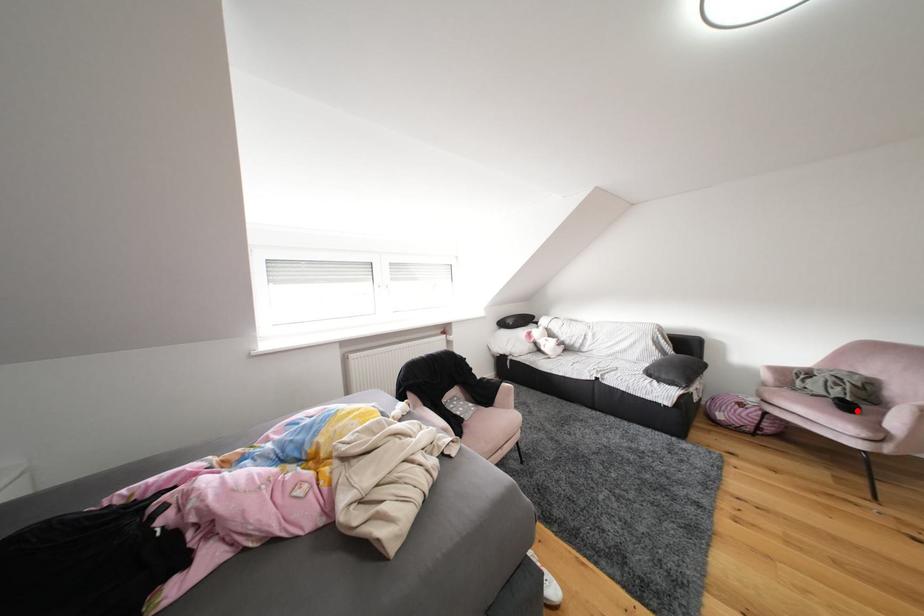
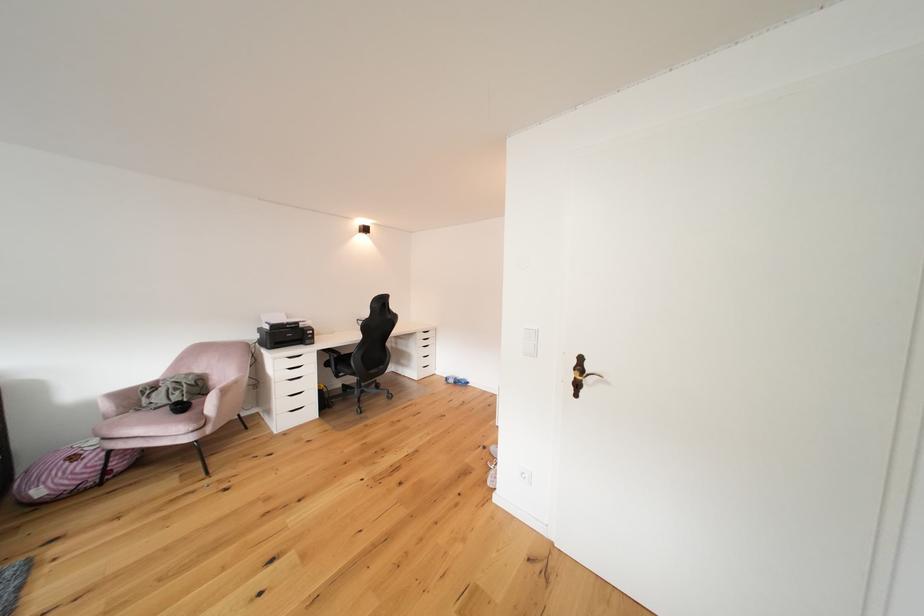
The point at the highlighted location is marked in the first image. Where is the corresponding point in the second image?

(190, 411)